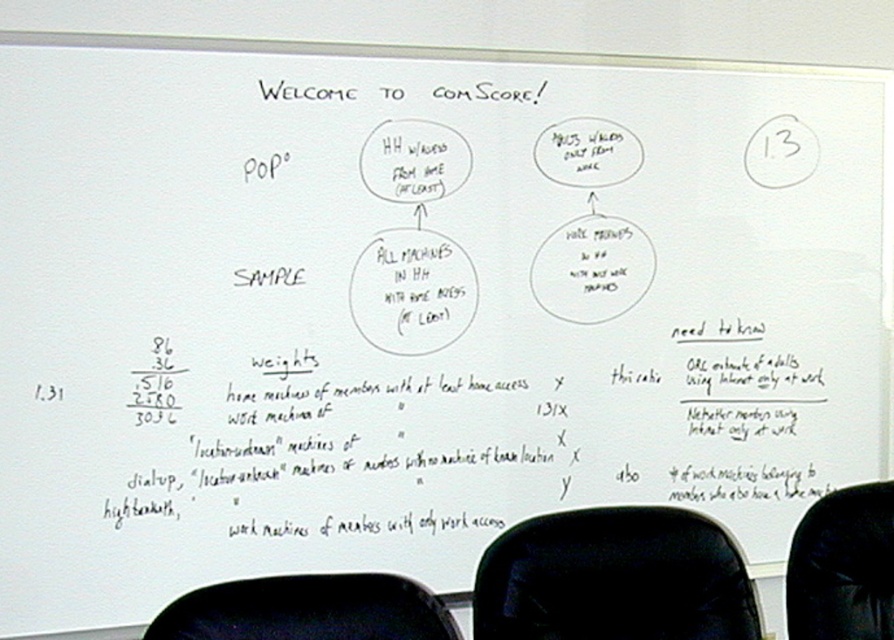
Does black fabric swivel chair at lower center have a larger size compared to black fabric armchair at lower center?

Yes, black fabric swivel chair at lower center is bigger than black fabric armchair at lower center.

Is point (540, 600) less distant than point (283, 620)?

No, (540, 600) is behind (283, 620).

This screenshot has height=640, width=894. In order to click on black fabric swivel chair at lower center in this screenshot , I will do `click(614, 579)`.

Is black fabric swivel chair at lower center closer to camera compared to black fabric armchair at lower right?

Yes, it is in front of black fabric armchair at lower right.

Between black fabric swivel chair at lower center and black fabric armchair at lower right, which one appears on the left side from the viewer's perspective?

black fabric swivel chair at lower center is more to the left.

Is point (679, 627) behind point (793, 561)?

No, (679, 627) is closer to viewer.

Where is `black fabric swivel chair at lower center`? Image resolution: width=894 pixels, height=640 pixels. black fabric swivel chair at lower center is located at coordinates (614, 579).

Can you confirm if black fabric armchair at lower center is positioned below black fabric armchair at lower right?

Actually, black fabric armchair at lower center is above black fabric armchair at lower right.

Can you confirm if black fabric armchair at lower center is positioned to the left of black fabric armchair at lower right?

Indeed, black fabric armchair at lower center is positioned on the left side of black fabric armchair at lower right.

Is point (397, 620) closer to viewer compared to point (880, 612)?

Yes.

Image resolution: width=894 pixels, height=640 pixels. In order to click on black fabric armchair at lower center in this screenshot , I will do (x=308, y=609).